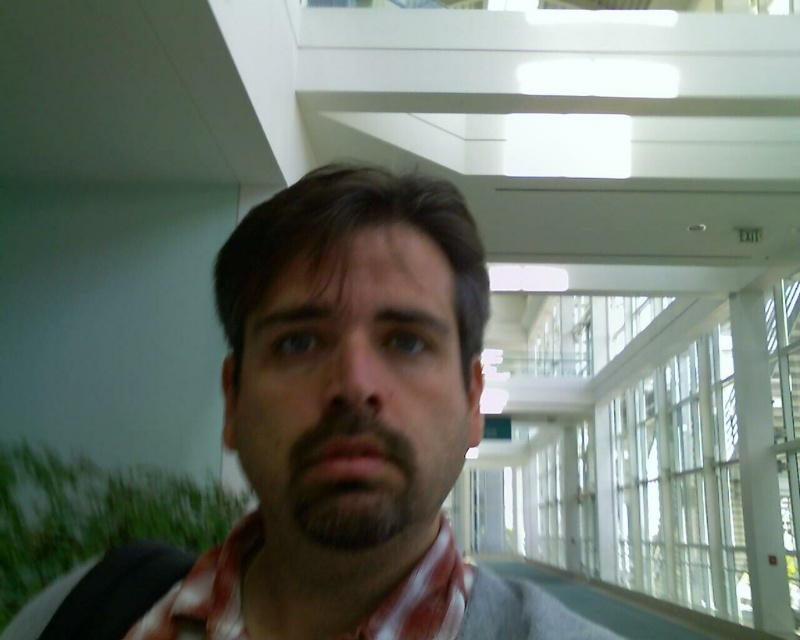
Question: Is matte gray shirt at center above red plaid scarf at center?

Choices:
 (A) no
 (B) yes

Answer: (B)

Question: Is matte gray shirt at center smaller than red plaid scarf at center?

Choices:
 (A) yes
 (B) no

Answer: (B)

Question: Is matte gray shirt at center wider than dark brown fuzzy beard at center?

Choices:
 (A) yes
 (B) no

Answer: (A)

Question: Which object appears closest to the camera in this image?

Choices:
 (A) red plaid scarf at center
 (B) dark brown fuzzy beard at center

Answer: (B)

Question: Which object appears farthest from the camera in this image?

Choices:
 (A) dark brown fuzzy beard at center
 (B) red plaid scarf at center

Answer: (B)

Question: Which object is closer to the camera taking this photo?

Choices:
 (A) matte gray shirt at center
 (B) red plaid scarf at center

Answer: (A)